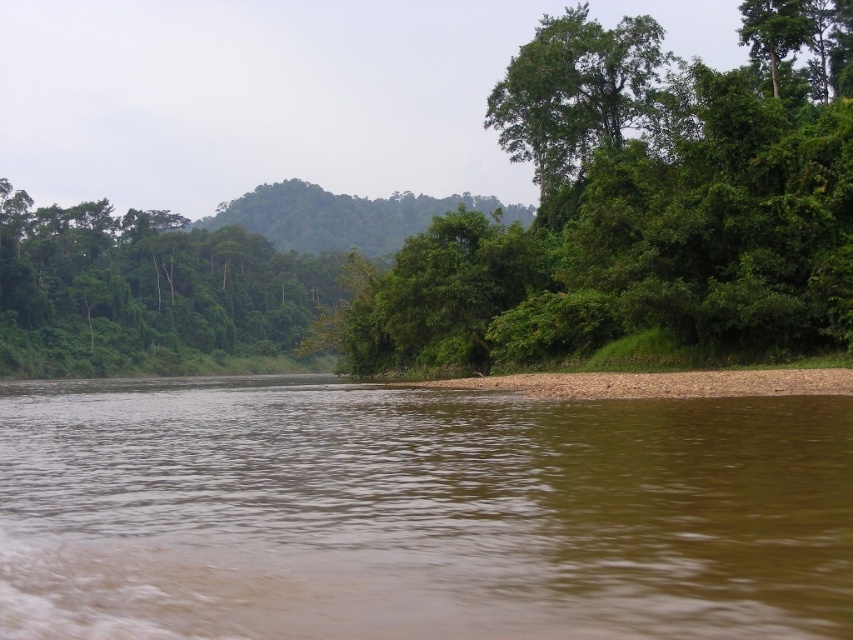
Can you confirm if brown muddy water at lower center is thinner than green leafy tree at center?

Correct, brown muddy water at lower center's width is less than green leafy tree at center's.

Can you confirm if brown muddy water at lower center is wider than green leafy tree at center?

No.

Is point (480, 486) positioned before point (804, 280)?

That is True.

I want to click on brown muddy water at lower center, so click(x=416, y=513).

Does brown muddy water at lower center have a greater height compared to green leafy trees at left?

Incorrect, brown muddy water at lower center's height is not larger of green leafy trees at left's.

Between point (323, 488) and point (258, 292), which one is positioned in front?

Point (323, 488) is more forward.

Where is `brown muddy water at lower center`? This screenshot has width=853, height=640. brown muddy water at lower center is located at coordinates (416, 513).

Does green leafy tree at center appear under green leafy tree at upper center?

Yes.

Between green leafy tree at center and green leafy tree at upper center, which one has more height?

With more height is green leafy tree at center.

Does point (672, 212) come closer to viewer compared to point (625, 84)?

Yes, point (672, 212) is in front of point (625, 84).

This screenshot has height=640, width=853. I want to click on green leafy tree at center, so (x=637, y=205).